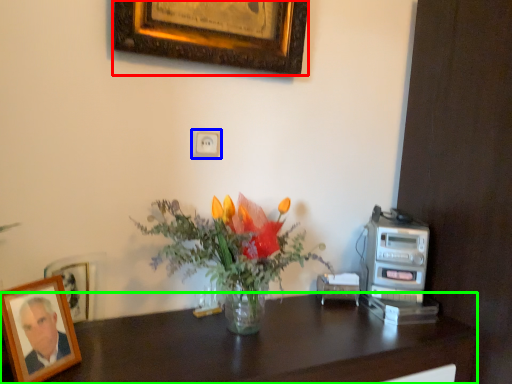
Question: Which object is the farthest from picture frame (highlighted by a red box)? Choose among these: electric outlet (highlighted by a blue box) or desk (highlighted by a green box).

Choices:
 (A) electric outlet
 (B) desk

Answer: (B)